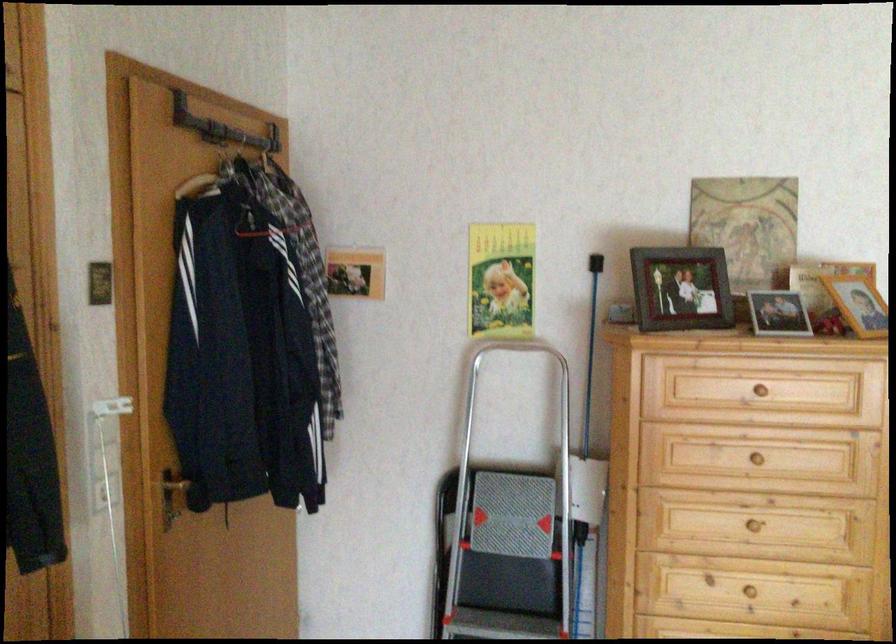
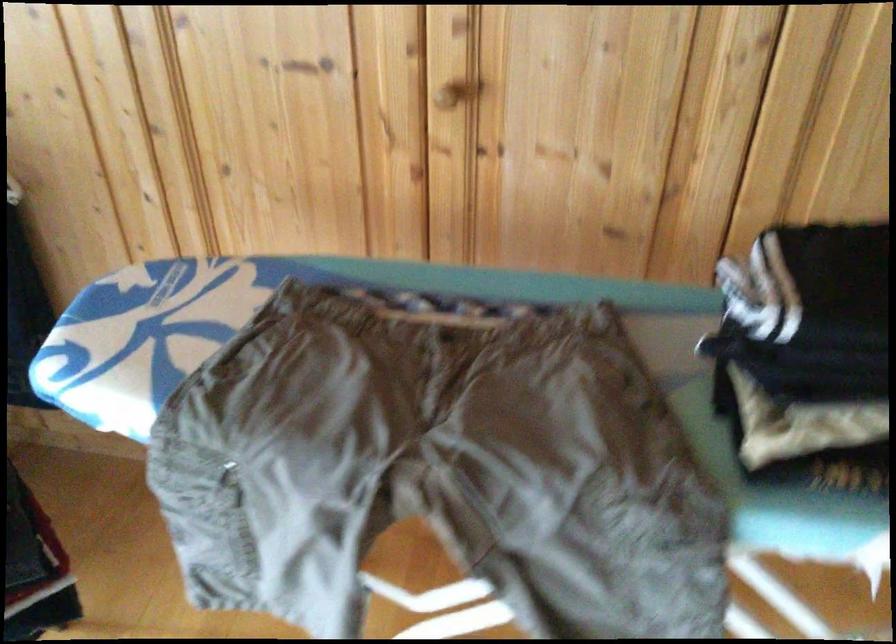
First-person continuous shooting, in which direction is the camera rotating?

The camera rotated toward left-down.